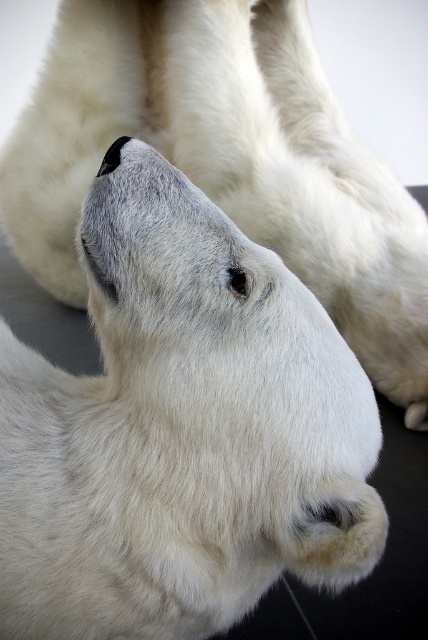
Question: Which point is closer to the camera?

Choices:
 (A) white fur polar bear at center
 (B) white fur at center

Answer: (A)

Question: Which point appears closest to the camera in this image?

Choices:
 (A) pos(62,168)
 (B) pos(175,264)

Answer: (B)

Question: Does white fur polar bear at center come behind white fur at center?

Choices:
 (A) yes
 (B) no

Answer: (B)

Question: Considering the relative positions of white fur polar bear at center and white fur at center in the image provided, where is white fur polar bear at center located with respect to white fur at center?

Choices:
 (A) left
 (B) right

Answer: (A)

Question: Which object appears closest to the camera in this image?

Choices:
 (A) white fur at center
 (B) white fur polar bear at center

Answer: (B)

Question: Does white fur polar bear at center have a greater width compared to white fur at center?

Choices:
 (A) no
 (B) yes

Answer: (A)